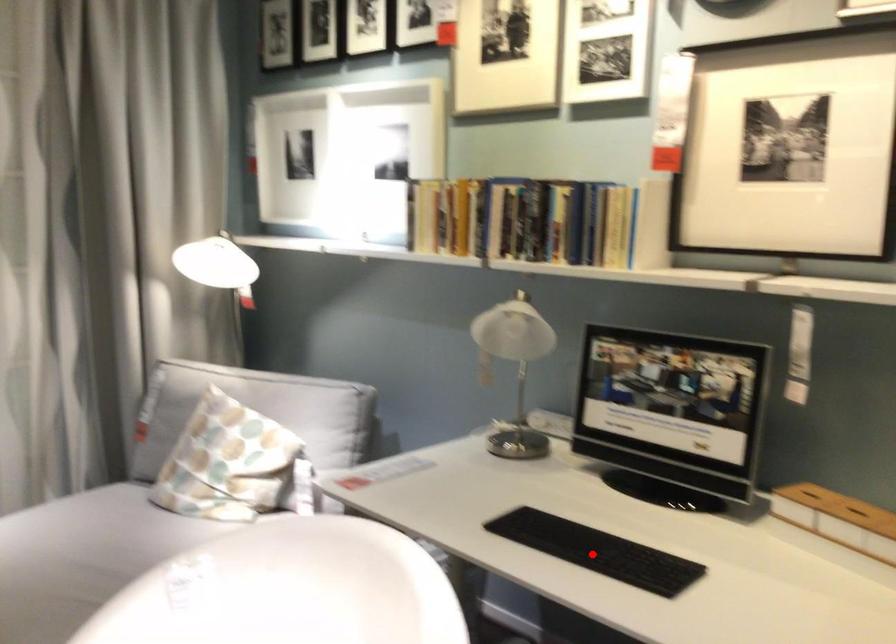
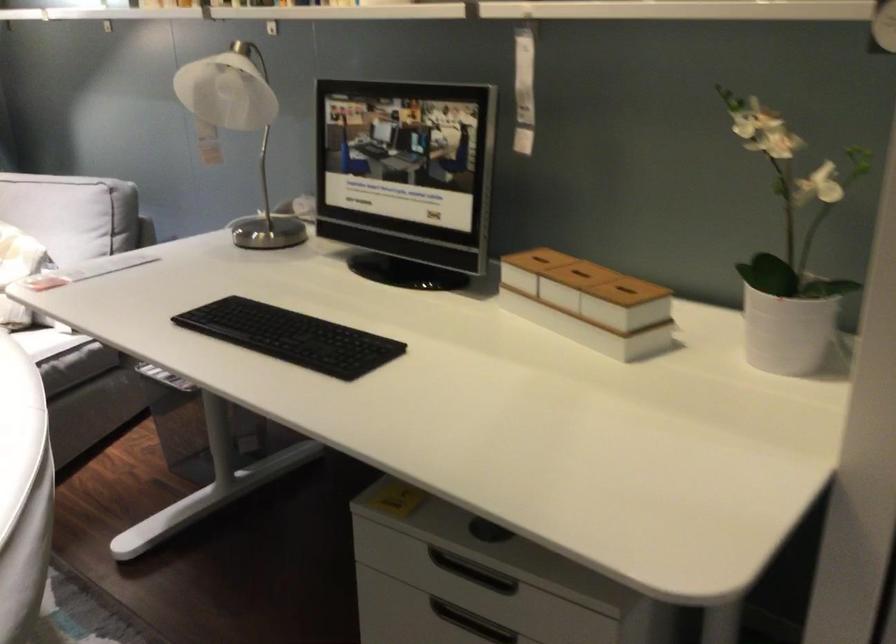
In the second image, find the point that corresponds to the highlighted location in the first image.

(291, 337)